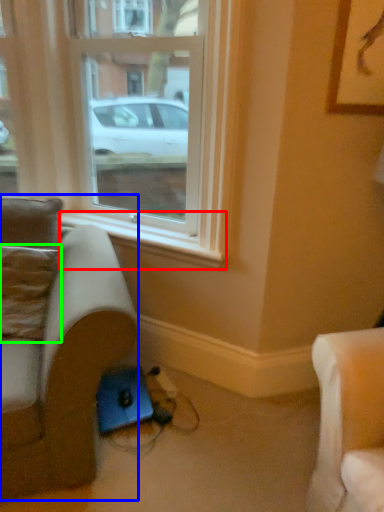
Question: Considering the real-world distances, which object is closest to window sill (highlighted by a red box)? studio couch (highlighted by a blue box) or pillow (highlighted by a green box).

Choices:
 (A) studio couch
 (B) pillow

Answer: (B)